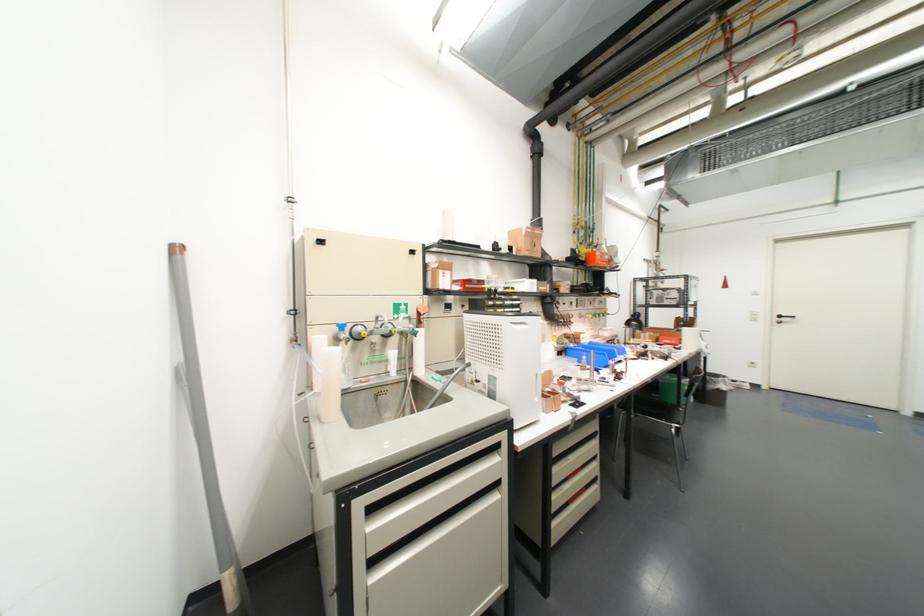
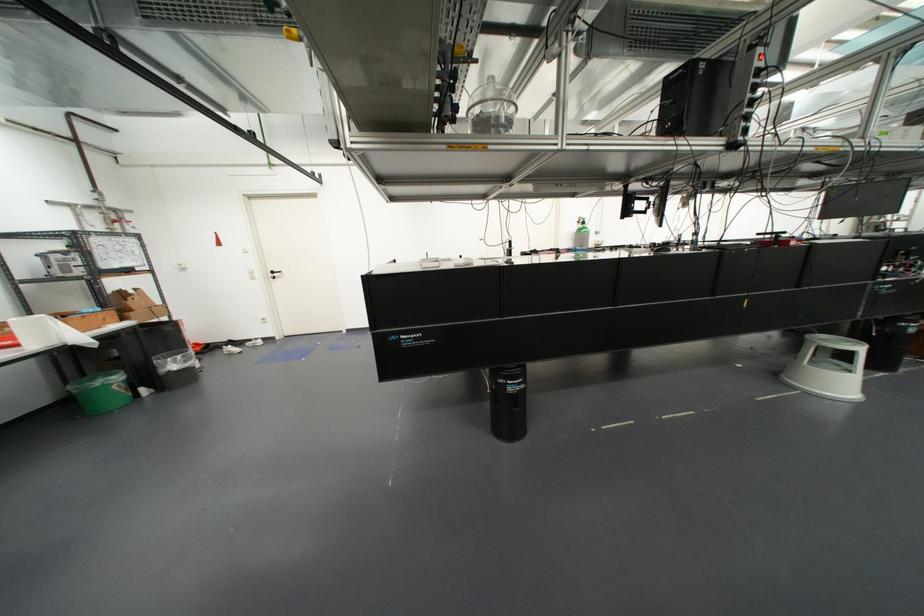
The point at (784, 318) is marked in the first image. Where is the corresponding point in the second image?

(274, 275)